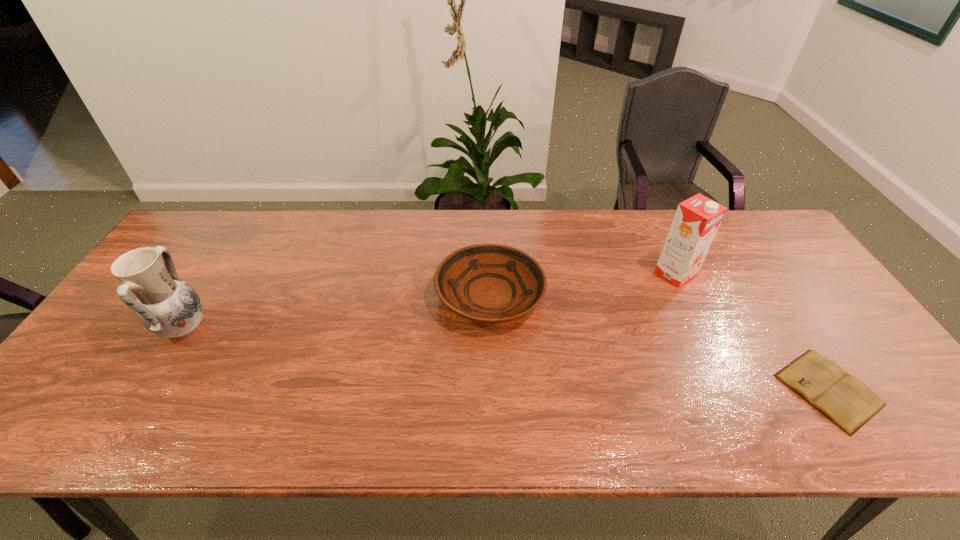
The width and height of the screenshot is (960, 540). What are the coordinates of `object that is the third nearest to the leftmost object` in the screenshot? It's located at (849, 403).

This screenshot has height=540, width=960. Find the location of `blank area in the image that satisfies the following two spatial constraints: 1. on the back side of the second object from left to right; 2. on the left side of the third object from left to right`. blank area in the image that satisfies the following two spatial constraints: 1. on the back side of the second object from left to right; 2. on the left side of the third object from left to right is located at coordinates (490, 274).

The height and width of the screenshot is (540, 960). I want to click on free location that satisfies the following two spatial constraints: 1. on the front side of the plate; 2. on either side of the pottery, so click(x=491, y=329).

Locate an element on the screen. The height and width of the screenshot is (540, 960). free space that satisfies the following two spatial constraints: 1. on the back side of the third object from left to right; 2. on the right side of the third tallest object is located at coordinates (490, 274).

I want to click on free spot that satisfies the following two spatial constraints: 1. on either side of the pottery; 2. on the right side of the book, so click(146, 389).

You are a GUI agent. You are given a task and a screenshot of the screen. Output one action in this format:
    pyautogui.click(x=<x>, y=<y>)
    Task: Click on the vacant position in the image that satisfies the following two spatial constraints: 1. on either side of the leftmost object; 2. on the right side of the shortest object
    The width and height of the screenshot is (960, 540).
    Given the screenshot: What is the action you would take?
    pyautogui.click(x=146, y=389)